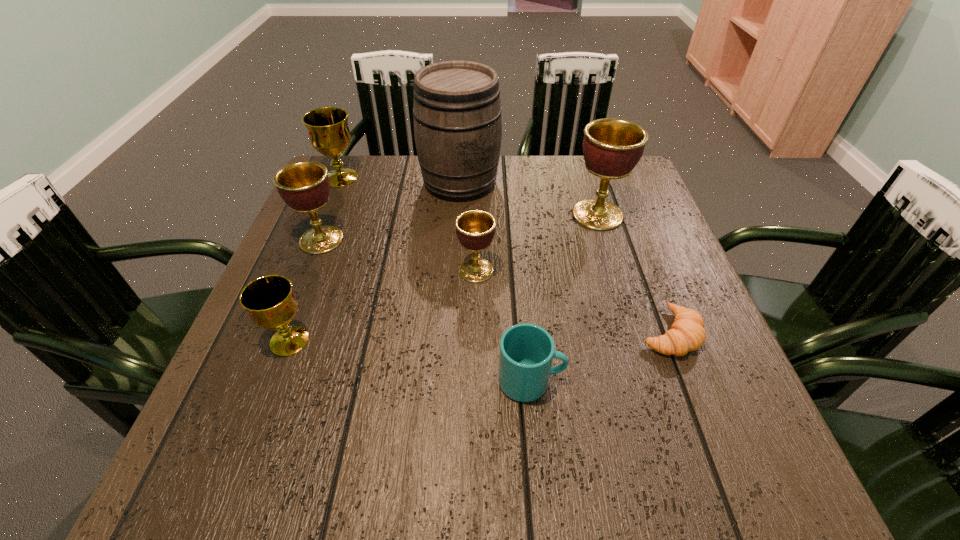
Locate an element on the screen. The image size is (960, 540). free space between the nearer gold chalice and the cup is located at coordinates (410, 361).

Image resolution: width=960 pixels, height=540 pixels. I want to click on unoccupied position between the second smallest golden chalice and the shortest object, so click(x=495, y=287).

This screenshot has width=960, height=540. In order to click on free space between the tallest object and the farthest chalice in this screenshot , I will do `click(400, 180)`.

The width and height of the screenshot is (960, 540). In order to click on free spot between the second shortest object and the nearer gold chalice in this screenshot , I will do `click(410, 361)`.

Find the location of a particular element. This screenshot has height=540, width=960. free space between the seventh tallest object and the farthest chalice is located at coordinates (436, 280).

You are a GUI agent. You are given a task and a screenshot of the screen. Output one action in this format:
    pyautogui.click(x=<x>, y=<y>)
    Task: Click on the free space between the crescent roll and the farther gold chalice
    This screenshot has width=960, height=540.
    Given the screenshot: What is the action you would take?
    pyautogui.click(x=505, y=255)

Image resolution: width=960 pixels, height=540 pixels. I want to click on free space that is in between the cup and the nearest golden chalice, so click(503, 326).

You are a GUI agent. You are given a task and a screenshot of the screen. Output one action in this format:
    pyautogui.click(x=<x>, y=<y>)
    Task: Click on the blank region between the farther gold chalice and the crescent roll
    This screenshot has height=540, width=960.
    Given the screenshot: What is the action you would take?
    pyautogui.click(x=505, y=255)

Identify the location of blank region between the wine bucket and the nearer gold chalice. (374, 261).

The width and height of the screenshot is (960, 540). What are the coordinates of `free area in between the leftmost golden chalice and the seventh tallest object` in the screenshot? It's located at click(426, 310).